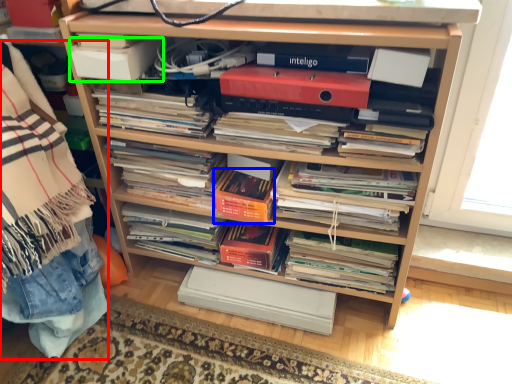
Question: Based on their relative distances, which object is farther from material (highlighted by a red box)? Choose from paperback book (highlighted by a blue box) and paperback book (highlighted by a green box).

Choices:
 (A) paperback book
 (B) paperback book

Answer: (A)